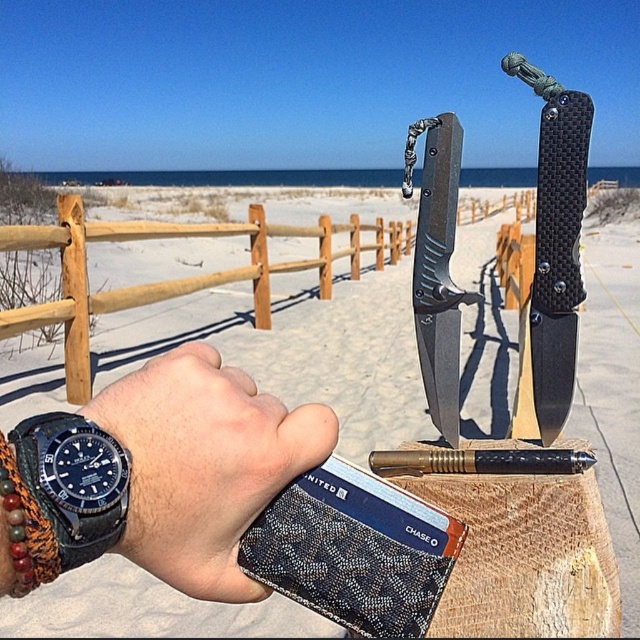
You are a jeweler examining two watches on a wooden post. The black leather watch at lower left and the matte black watch at lower left are both displayed. Which watch has a greater width?

The black leather watch at lower left has a greater width than the matte black watch at lower left.

You are a beachgoer who wants to know if your black leather watch at lower left will fit in your pocket without sticking out. Since the matte black knife at center is already in your pocket, can the watch fit alongside it?

The black leather watch at lower left is shorter than the matte black knife at center, so it should fit alongside the knife in your pocket since it is shorter.